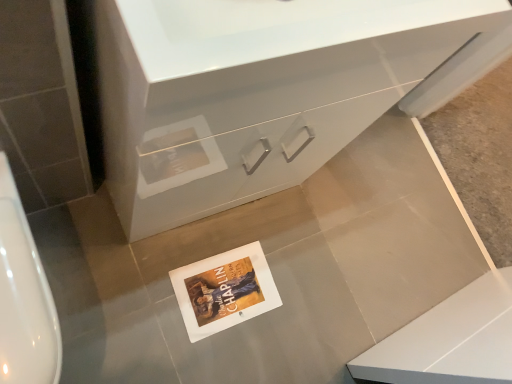
Identify the location of vacant area that is in front of white glossy cabinet at center. The width and height of the screenshot is (512, 384). (126, 276).